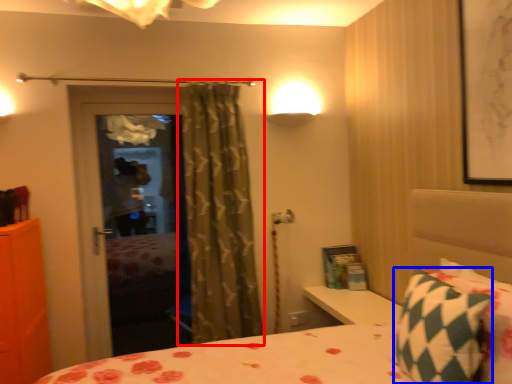
Question: Which object appears closest to the camera in this image, curtain (highlighted by a red box) or pillow (highlighted by a blue box)?

Choices:
 (A) curtain
 (B) pillow

Answer: (B)